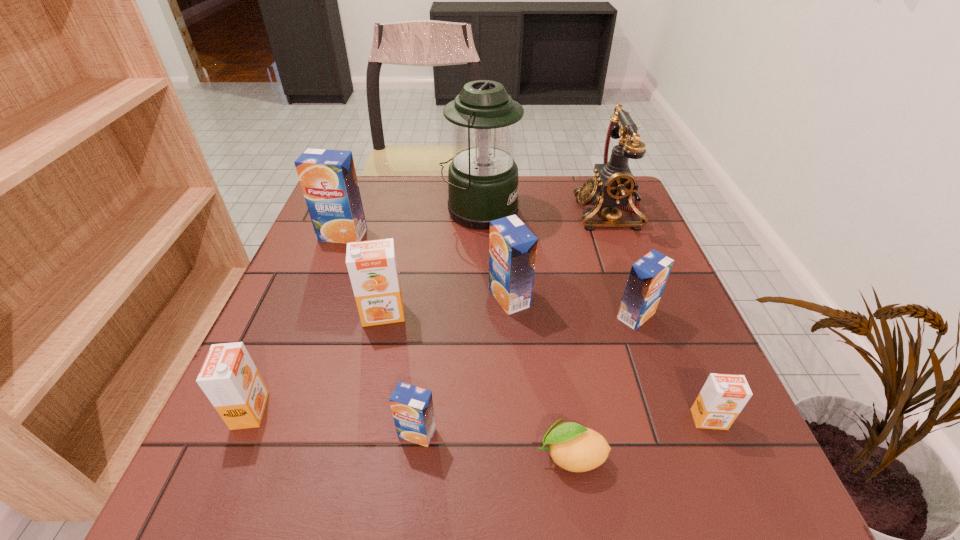
Locate an element on the screen. the third closest object to the rightmost orange orange juice is located at coordinates coord(512,246).

Point out which orange juice is positioned as the nearest to the smallest blue orange_juice. Please provide its 2D coordinates. Your answer should be formatted as a tuple, i.e. [(x, y)], where the tuple contains the x and y coordinates of a point satisfying the conditions above.

[(372, 266)]

The height and width of the screenshot is (540, 960). Identify the location of orange juice identified as the fourth closest to the smallest orange orange juice. (372, 266).

Locate which blue orange_juice is the second closest to the second orange orange juice from left to right. Please provide its 2D coordinates. Your answer should be formatted as a tuple, i.e. [(x, y)], where the tuple contains the x and y coordinates of a point satisfying the conditions above.

[(328, 178)]

Locate an element on the screen. blue orange_juice that is the closest to the leftmost orange orange juice is located at coordinates (412, 407).

Select which orange orange juice appears as the second closest to the lantern. Please provide its 2D coordinates. Your answer should be formatted as a tuple, i.e. [(x, y)], where the tuple contains the x and y coordinates of a point satisfying the conditions above.

[(229, 378)]

Select which orange orange juice appears as the closest to the rightmost orange orange juice. Please provide its 2D coordinates. Your answer should be formatted as a tuple, i.e. [(x, y)], where the tuple contains the x and y coordinates of a point satisfying the conditions above.

[(372, 266)]

Find the location of a particular element. free space that satisfies the following two spatial constraints: 1. on the front side of the nearest blue orange_juice; 2. on the left side of the biggest orange orange juice is located at coordinates (x=357, y=433).